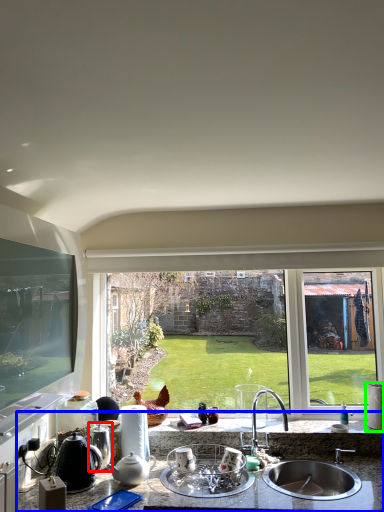
Question: Which is farther away from appliance (highlighted by a red box)? countertop (highlighted by a blue box) or appliance (highlighted by a green box)?

Choices:
 (A) countertop
 (B) appliance

Answer: (B)